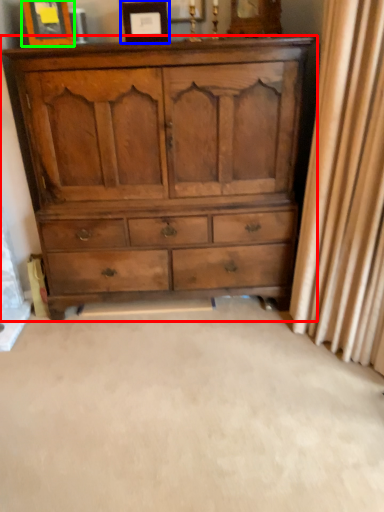
Question: Which object is positioned closest to chest of drawers (highlighted by a red box)? Select from picture frame (highlighted by a blue box) and picture frame (highlighted by a green box).

Choices:
 (A) picture frame
 (B) picture frame

Answer: (A)